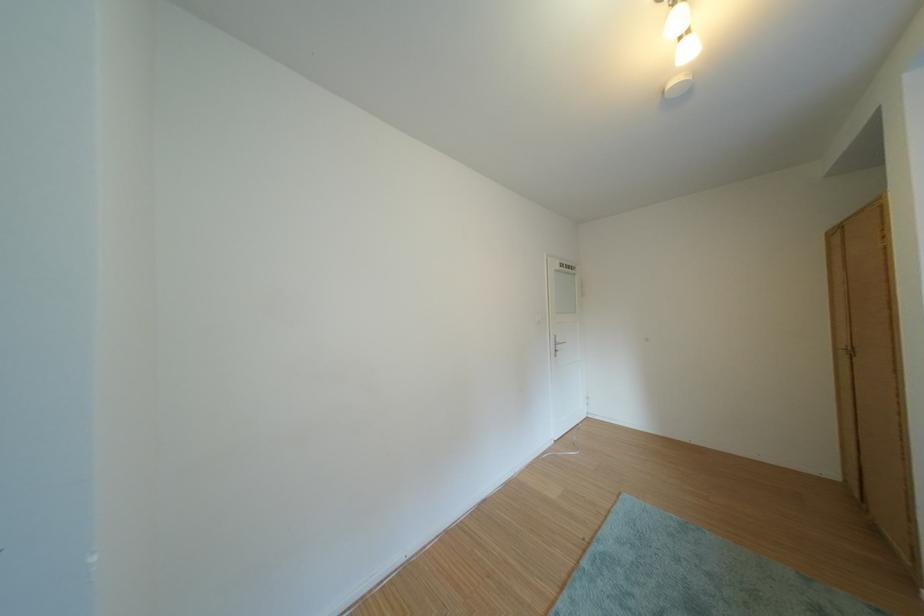
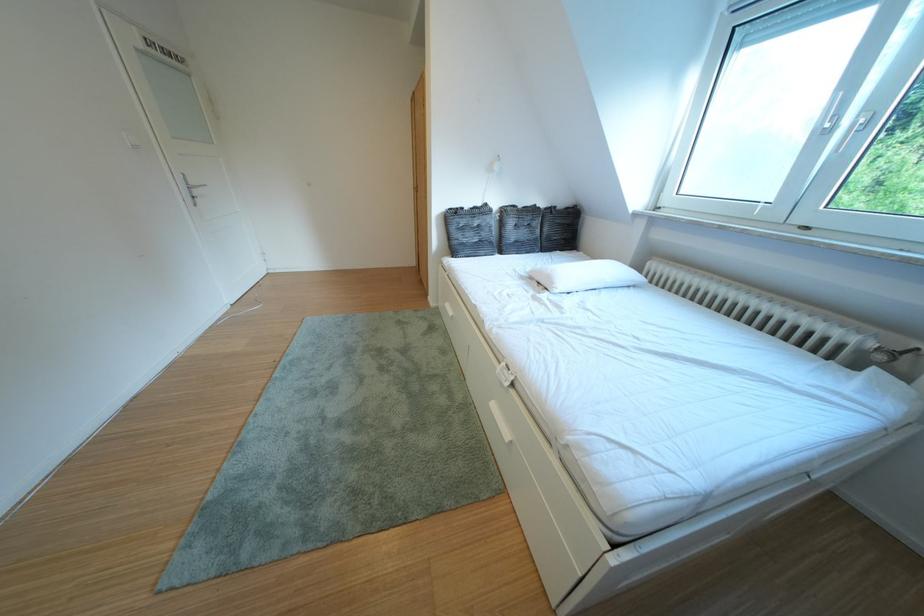
First-person continuous shooting, in which direction is the camera rotating?

The camera's rotation is toward right-down.